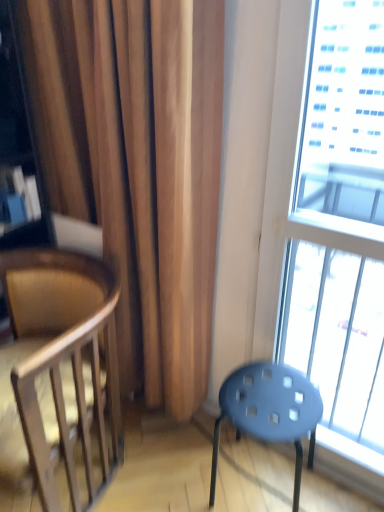
Question: Considering the relative sizes of matte blue stool at lower right and wooden chair at left in the image provided, is matte blue stool at lower right smaller than wooden chair at left?

Choices:
 (A) yes
 (B) no

Answer: (A)

Question: Is matte blue stool at lower right to the right of wooden chair at left from the viewer's perspective?

Choices:
 (A) no
 (B) yes

Answer: (B)

Question: Is matte blue stool at lower right thinner than wooden chair at left?

Choices:
 (A) no
 (B) yes

Answer: (B)

Question: Is wooden chair at left located within matte blue stool at lower right?

Choices:
 (A) yes
 (B) no

Answer: (B)

Question: Is matte blue stool at lower right taller than wooden chair at left?

Choices:
 (A) no
 (B) yes

Answer: (A)

Question: From a real-world perspective, is matte blue stool at lower right physically located above or below transparent glass window at right?

Choices:
 (A) above
 (B) below

Answer: (B)

Question: Considering the positions of matte blue stool at lower right and transparent glass window at right in the image, is matte blue stool at lower right taller or shorter than transparent glass window at right?

Choices:
 (A) tall
 (B) short

Answer: (B)

Question: Is matte blue stool at lower right spatially inside transparent glass window at right, or outside of it?

Choices:
 (A) outside
 (B) inside

Answer: (A)

Question: From the image's perspective, is matte blue stool at lower right located above or below transparent glass window at right?

Choices:
 (A) above
 (B) below

Answer: (B)

Question: Is transparent glass window at right in front of or behind wooden chair at left in the image?

Choices:
 (A) front
 (B) behind

Answer: (A)

Question: From a real-world perspective, is transparent glass window at right above or below wooden chair at left?

Choices:
 (A) below
 (B) above

Answer: (B)

Question: In terms of size, does transparent glass window at right appear bigger or smaller than wooden chair at left?

Choices:
 (A) big
 (B) small

Answer: (B)

Question: From the image's perspective, is transparent glass window at right above or below wooden chair at left?

Choices:
 (A) above
 (B) below

Answer: (A)

Question: Is point (72, 473) positioned closer to the camera than point (375, 121)?

Choices:
 (A) farther
 (B) closer

Answer: (B)

Question: Is wooden chair at left inside or outside of transparent glass window at right?

Choices:
 (A) outside
 (B) inside

Answer: (A)